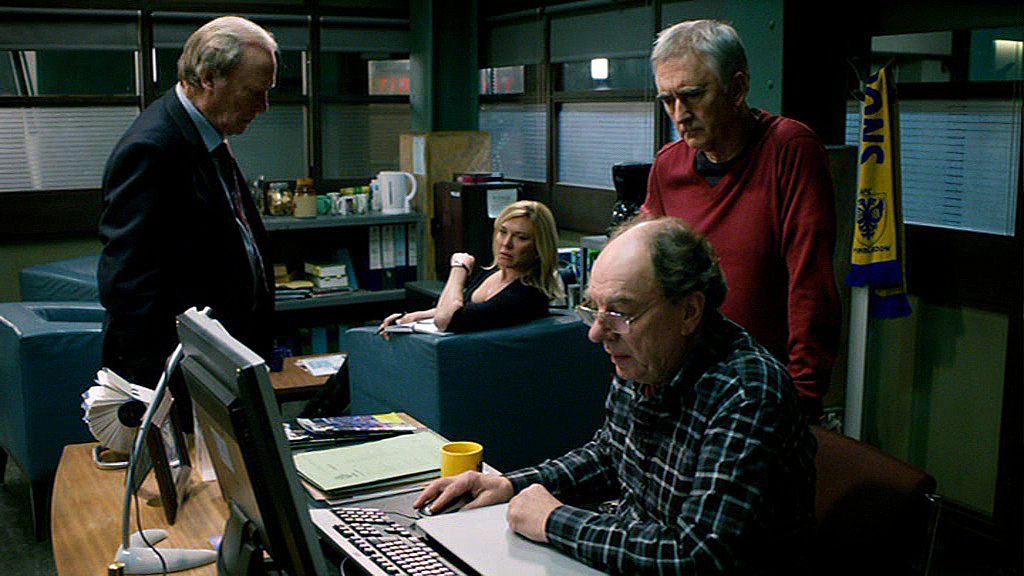
At what (x,y) coordinates should I click in order to perform the action: click on chair. Please return your answer as a coordinate pair (x, y). Image resolution: width=1024 pixels, height=576 pixels. Looking at the image, I should click on (57, 365), (481, 363).